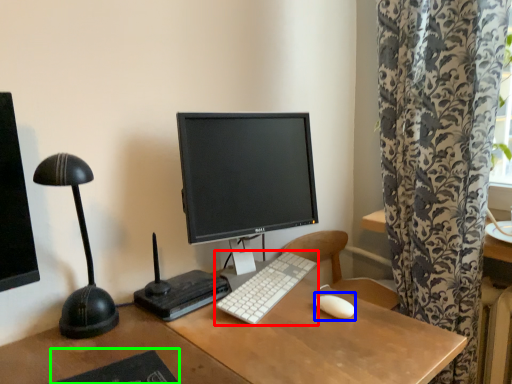
Question: Which object is positioned closest to computer keyboard (highlighted by a red box)? Select from mouse (highlighted by a blue box) and mousepad (highlighted by a green box).

Choices:
 (A) mouse
 (B) mousepad

Answer: (A)